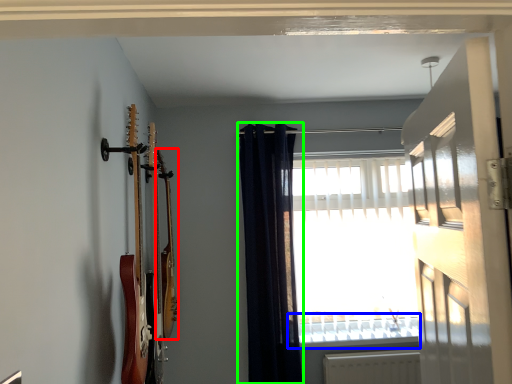
Question: Based on their relative distances, which object is farther from guitar (highlighted by a red box)? Choose from window sill (highlighted by a blue box) and curtain (highlighted by a green box).

Choices:
 (A) window sill
 (B) curtain

Answer: (A)